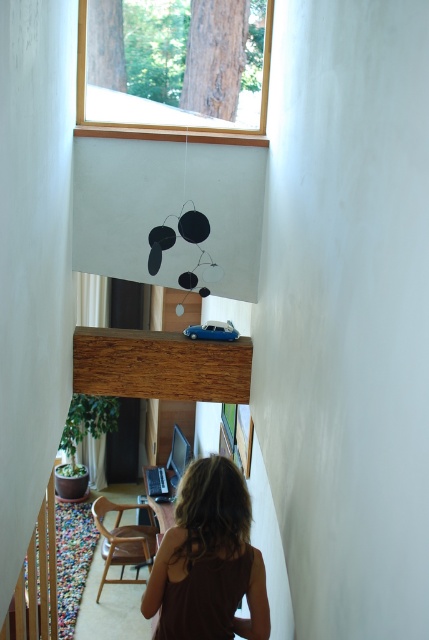
You are standing at the bottom of the staircase in this cozy indoor scene. You see two points marked in the image. The first is at point coordinates point (96, 122) and the second is at point coordinates point (238, 589). Which point is closer to you?

Point (96, 122) is closer to you because it is further to the viewer than point (238, 589).

You are an interior designer planning to hang a new painting. You see the wooden frame at upper center and the brown fabric at lower center. Which object is located above the other?

The wooden frame at upper center is positioned over brown fabric at lower center, so it is above the brown fabric at lower center.

From the picture: You are a person who wants to place a 7.5 feet long ladder from the brown fabric at lower center to the wooden frame at upper center. Is the ladder long enough to reach?

The distance between the wooden frame at upper center and the brown fabric at lower center is 7.36 feet. The ladder is 7.5 feet long, so it is just long enough to reach.